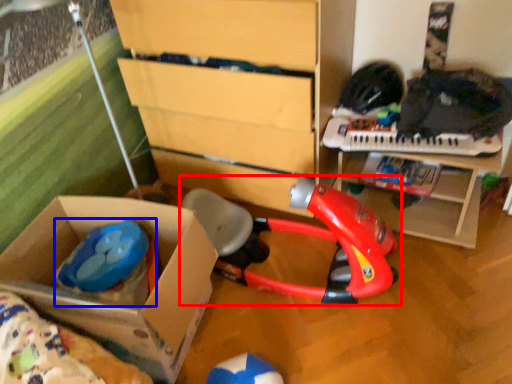
Question: Among these objects, which one is farthest to the camera, toy (highlighted by a red box) or toy (highlighted by a blue box)?

Choices:
 (A) toy
 (B) toy

Answer: (B)